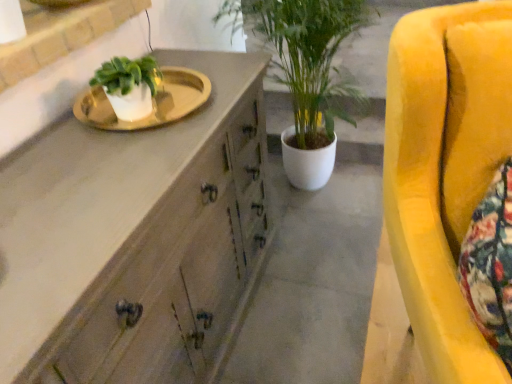
The height and width of the screenshot is (384, 512). What do you see at coordinates (135, 237) in the screenshot? I see `wooden cabinet at center` at bounding box center [135, 237].

What is the approximate height of wooden cabinet at center?

wooden cabinet at center is 34.25 inches in height.

At what (x,y) coordinates should I click in order to perform the action: click on velvet yellow armchair at right. Please return your answer as a coordinate pair (x, y). The width and height of the screenshot is (512, 384). Looking at the image, I should click on (445, 169).

Measure the distance between point (399, 157) and camera.

Point (399, 157) is 38.62 inches from camera.

Image resolution: width=512 pixels, height=384 pixels. Describe the element at coordinates (314, 284) in the screenshot. I see `concreteroughcabinet at center` at that location.

This screenshot has height=384, width=512. Identify the location of wooden cabinet at center. (135, 237).

Considering the sizes of objects white glossy sink at upper left and velvet yellow armchair at right in the image provided, who is bigger, white glossy sink at upper left or velvet yellow armchair at right?

With larger size is velvet yellow armchair at right.

Considering the positions of point (170, 71) and point (449, 46), is point (170, 71) closer or farther from the camera than point (449, 46)?

Point (170, 71) appears to be farther away from the viewer than point (449, 46).

Looking at this image, which of these two, white glossy sink at upper left or velvet yellow armchair at right, stands shorter?

white glossy sink at upper left.

Is concreteroughcabinet at center positioned in front of velvet yellow armchair at right?

No.

From the image's perspective, is concreteroughcabinet at center below velvet yellow armchair at right?

Indeed, from the image's perspective, concreteroughcabinet at center is shown beneath velvet yellow armchair at right.

Considering the sizes of concreteroughcabinet at center and velvet yellow armchair at right in the image, is concreteroughcabinet at center wider or thinner than velvet yellow armchair at right?

Clearly, concreteroughcabinet at center has less width compared to velvet yellow armchair at right.

Would you say concreteroughcabinet at center is inside or outside wooden cabinet at center?

concreteroughcabinet at center is outside wooden cabinet at center.

Is point (260, 360) in front of point (15, 277)?

No, (260, 360) is behind (15, 277).

Is concreteroughcabinet at center turned away from wooden cabinet at center?

No, wooden cabinet at center is not at the back of concreteroughcabinet at center.

From the picture: From a real-world perspective, who is located lower, concreteroughcabinet at center or wooden cabinet at center?

concreteroughcabinet at center.

Is white glossy sink at upper left next to concreteroughcabinet at center?

They are not placed beside each other.

Would you say white glossy sink at upper left is inside or outside concreteroughcabinet at center?

white glossy sink at upper left is spatially situated outside concreteroughcabinet at center.

Which of these two, white glossy sink at upper left or concreteroughcabinet at center, is thinner?

With smaller width is white glossy sink at upper left.

Considering the positions of objects velvet yellow armchair at right and white glossy sink at upper left in the image provided, who is behind, velvet yellow armchair at right or white glossy sink at upper left?

white glossy sink at upper left is more distant.

Find the location of a particular element. The height and width of the screenshot is (384, 512). chair to the right of white glossy sink at upper left is located at coordinates (445, 169).

Is velvet yellow armchair at right not near white glossy sink at upper left?

No, velvet yellow armchair at right is not far away from white glossy sink at upper left.

How different are the orientations of wooden cabinet at center and concreteroughcabinet at center in degrees?

There is a 179-degree angle between the facing directions of wooden cabinet at center and concreteroughcabinet at center.

Could you tell me if wooden cabinet at center is facing concreteroughcabinet at center?

Yes.

Measure the distance from wooden cabinet at center to concreteroughcabinet at center.

wooden cabinet at center and concreteroughcabinet at center are 54.46 centimeters apart from each other.

Is wooden cabinet at center not near concreteroughcabinet at center?

Actually, wooden cabinet at center and concreteroughcabinet at center are a little close together.

Could you tell me if wooden cabinet at center is facing velvet yellow armchair at right?

Yes, wooden cabinet at center faces towards velvet yellow armchair at right.

Is wooden cabinet at center in front of or behind velvet yellow armchair at right in the image?

wooden cabinet at center is positioned farther from the viewer than velvet yellow armchair at right.

From a real-world perspective, which object stands above the other?

velvet yellow armchair at right.

Which object is wider, wooden cabinet at center or velvet yellow armchair at right?

velvet yellow armchair at right.

Find the location of a particular element. sink on the left side of velvet yellow armchair at right is located at coordinates (152, 101).

Locate an element on the screen. This screenshot has height=384, width=512. concrete below the velvet yellow armchair at right (from the image's perspective) is located at coordinates (314, 284).

Based on their spatial positions, is velvet yellow armchair at right or white glossy sink at upper left closer to concreteroughcabinet at center?

velvet yellow armchair at right.

Estimate the real-world distances between objects in this image. Which object is closer to concreteroughcabinet at center, velvet yellow armchair at right or wooden cabinet at center?

wooden cabinet at center lies closer to concreteroughcabinet at center than the other object.

Estimate the real-world distances between objects in this image. Which object is closer to wooden cabinet at center, velvet yellow armchair at right or concreteroughcabinet at center?

concreteroughcabinet at center is positioned closer to the anchor wooden cabinet at center.

Estimate the real-world distances between objects in this image. Which object is further from wooden cabinet at center, white glossy sink at upper left or concreteroughcabinet at center?

The object further to wooden cabinet at center is concreteroughcabinet at center.

Looking at the image, which one is located closer to velvet yellow armchair at right, wooden cabinet at center or concreteroughcabinet at center?

wooden cabinet at center lies closer to velvet yellow armchair at right than the other object.

Looking at the image, which one is located closer to concreteroughcabinet at center, wooden cabinet at center or velvet yellow armchair at right?

Based on the image, wooden cabinet at center appears to be nearer to concreteroughcabinet at center.

From the image, which object appears to be nearer to white glossy sink at upper left, velvet yellow armchair at right or concreteroughcabinet at center?

velvet yellow armchair at right.

Which object lies further to the anchor point concreteroughcabinet at center, white glossy sink at upper left or velvet yellow armchair at right?

white glossy sink at upper left.

Image resolution: width=512 pixels, height=384 pixels. I want to click on concrete between wooden cabinet at center and velvet yellow armchair at right in the horizontal direction, so click(314, 284).

Locate an element on the screen. This screenshot has width=512, height=384. concrete between white glossy sink at upper left and velvet yellow armchair at right in the horizontal direction is located at coordinates (314, 284).

You are a GUI agent. You are given a task and a screenshot of the screen. Output one action in this format:
    pyautogui.click(x=<x>, y=<y>)
    Task: Click on the sink between wooden cabinet at center and velvet yellow armchair at right
    Image resolution: width=512 pixels, height=384 pixels.
    Given the screenshot: What is the action you would take?
    pyautogui.click(x=152, y=101)

Find the location of a particular element. sink situated between wooden cabinet at center and concreteroughcabinet at center from left to right is located at coordinates (152, 101).